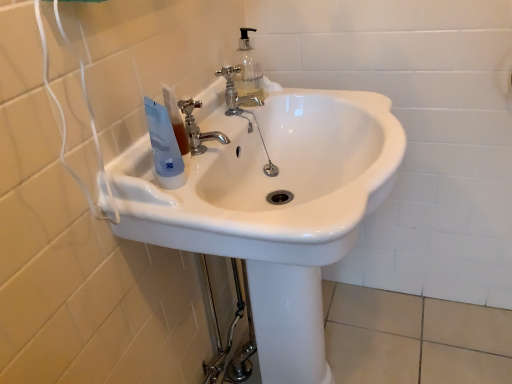
Question: Is white glossy sink at center oriented away from blue plastic tube at upper left?

Choices:
 (A) yes
 (B) no

Answer: (B)

Question: From a real-world perspective, is white glossy sink at center positioned over blue plastic tube at upper left based on gravity?

Choices:
 (A) yes
 (B) no

Answer: (B)

Question: Is white glossy sink at center smaller than blue plastic tube at upper left?

Choices:
 (A) no
 (B) yes

Answer: (A)

Question: Can you confirm if white glossy sink at center is shorter than blue plastic tube at upper left?

Choices:
 (A) yes
 (B) no

Answer: (B)

Question: From a real-world perspective, does white glossy sink at center sit lower than blue plastic tube at upper left?

Choices:
 (A) no
 (B) yes

Answer: (B)

Question: Is white glossy sink at center oriented towards blue plastic tube at upper left?

Choices:
 (A) no
 (B) yes

Answer: (A)

Question: From the image's perspective, would you say chrome metallic faucet at upper center, which is the first tap in right-to-left order, is positioned over blue plastic tube at upper left?

Choices:
 (A) yes
 (B) no

Answer: (A)

Question: Considering the relative sizes of chrome metallic faucet at upper center, which appears as the 1th tap when viewed from the back, and blue plastic tube at upper left in the image provided, is chrome metallic faucet at upper center, which appears as the 1th tap when viewed from the back, taller than blue plastic tube at upper left?

Choices:
 (A) yes
 (B) no

Answer: (B)

Question: Could you tell me if chrome metallic faucet at upper center, which appears as the 1th tap when viewed from the back, is turned towards blue plastic tube at upper left?

Choices:
 (A) no
 (B) yes

Answer: (A)

Question: Can you confirm if chrome metallic faucet at upper center, positioned as the 2th tap in front-to-back order, is positioned to the left of blue plastic tube at upper left?

Choices:
 (A) no
 (B) yes

Answer: (A)

Question: Is chrome metallic faucet at upper center, positioned as the 2th tap in front-to-back order, further to camera compared to blue plastic tube at upper left?

Choices:
 (A) yes
 (B) no

Answer: (A)

Question: Is chrome metallic faucet at upper center, which is the first tap in right-to-left order, not inside blue plastic tube at upper left?

Choices:
 (A) yes
 (B) no

Answer: (A)

Question: From the image's perspective, does white glossy sink at center appear lower than chrome metallic faucet at center, acting as the second tap starting from the top?

Choices:
 (A) yes
 (B) no

Answer: (A)